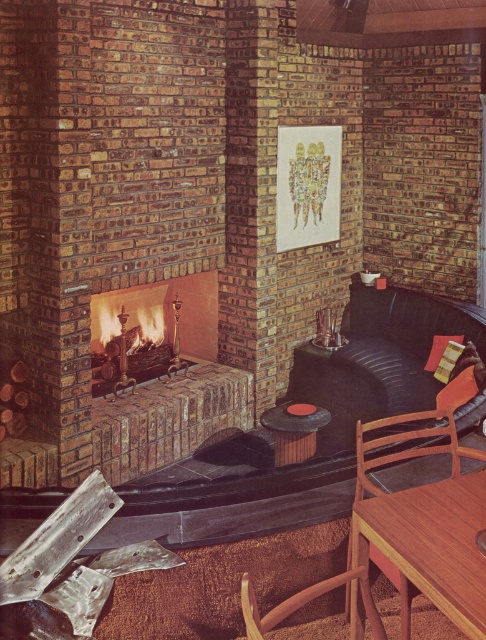
Question: Which is farther from the black leather couch at center?

Choices:
 (A) brick fireplace at center
 (B) brown leather armchair at lower center

Answer: (B)

Question: Estimate the real-world distances between objects in this image. Which object is closer to the black leather couch at center?

Choices:
 (A) brick fireplace at center
 (B) teak wood table at lower right

Answer: (A)

Question: Among these points, which one is nearest to the camera?

Choices:
 (A) (215, 278)
 (B) (443, 522)
 (C) (261, 632)

Answer: (C)

Question: Is black leather couch at center thinner than brown leather armchair at lower center?

Choices:
 (A) no
 (B) yes

Answer: (A)

Question: Is the position of black leather couch at center more distant than that of brown leather armchair at lower center?

Choices:
 (A) yes
 (B) no

Answer: (A)

Question: Is brick fireplace at center positioned before brown leather armchair at lower center?

Choices:
 (A) no
 (B) yes

Answer: (A)